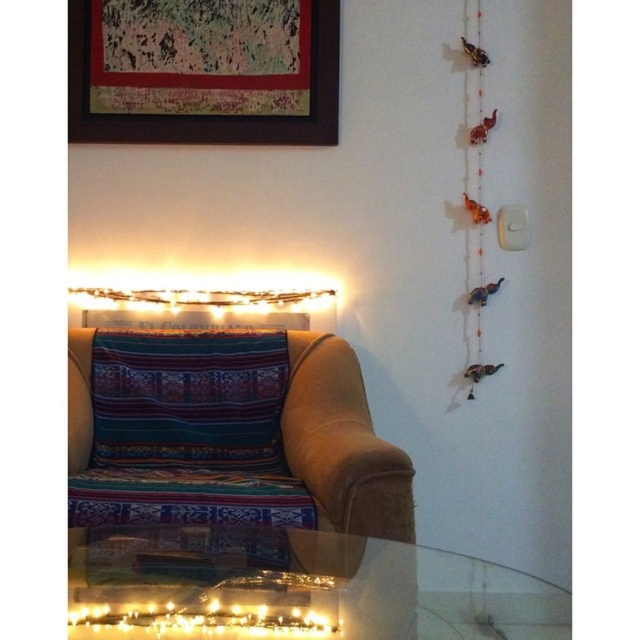
From the picture: Who is lower down, wooden framed artwork at upper left or orange beaded string at right?

orange beaded string at right

Who is positioned more to the right, wooden framed artwork at upper left or orange beaded string at right?

Positioned to the right is orange beaded string at right.

Where is `wooden framed artwork at upper left`? The image size is (640, 640). wooden framed artwork at upper left is located at coordinates (204, 72).

The height and width of the screenshot is (640, 640). Identify the location of wooden framed artwork at upper left. (204, 72).

Does transparent glass table at lower center have a greater height compared to orange beaded string at right?

Incorrect, transparent glass table at lower center's height is not larger of orange beaded string at right's.

Who is more forward, (400, 593) or (468, 26)?

Positioned in front is point (400, 593).

Identify the location of transparent glass table at lower center. (298, 588).

What do you see at coordinates (342, 444) in the screenshot? I see `multicolored woven fabric couch at center` at bounding box center [342, 444].

Where is `multicolored woven fabric couch at center`? Image resolution: width=640 pixels, height=640 pixels. multicolored woven fabric couch at center is located at coordinates (342, 444).

Identify the location of multicolored woven fabric couch at center. This screenshot has width=640, height=640. (342, 444).